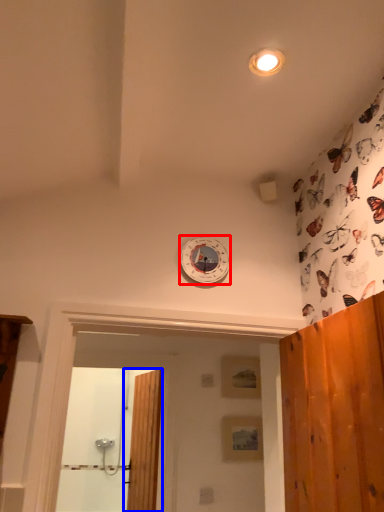
Question: Among these objects, which one is farthest to the camera, clock (highlighted by a red box) or door (highlighted by a blue box)?

Choices:
 (A) clock
 (B) door

Answer: (B)